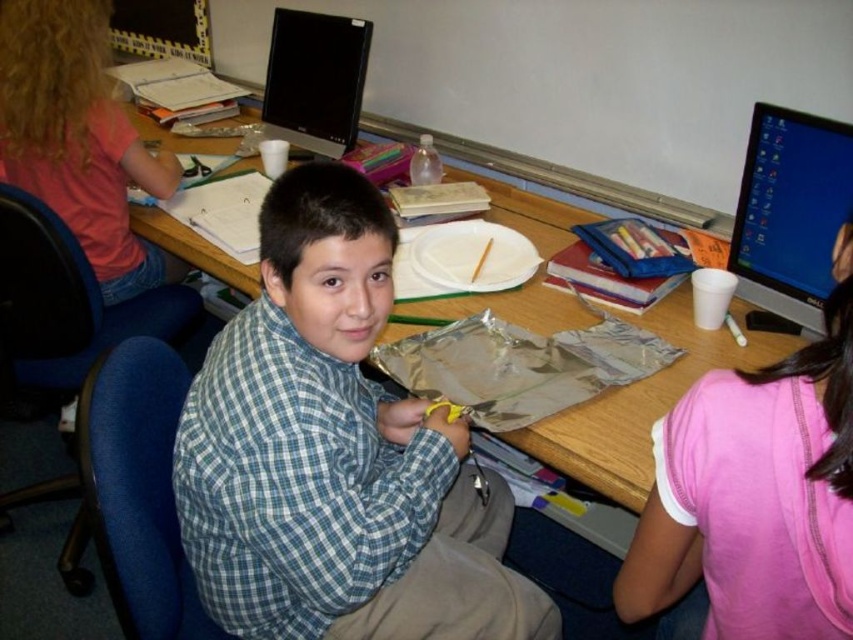
Question: Can you confirm if wooden desk at center is smaller than matte black monitor at upper right?

Choices:
 (A) no
 (B) yes

Answer: (A)

Question: Does blue plaid shirt at center have a smaller size compared to matte black monitor at upper right?

Choices:
 (A) no
 (B) yes

Answer: (A)

Question: Does blue plaid shirt at center have a larger size compared to wooden desk at center?

Choices:
 (A) no
 (B) yes

Answer: (A)

Question: Which of the following is the closest to the observer?

Choices:
 (A) (351, 33)
 (B) (332, 204)

Answer: (B)

Question: Which of the following is the closest to the observer?

Choices:
 (A) blue plaid shirt at center
 (B) wooden desk at center
 (C) matte black monitor at upper center

Answer: (A)

Question: Which point is closer to the camera taking this photo?

Choices:
 (A) (780, 182)
 (B) (792, 637)
 (C) (311, 81)
 (D) (349, 344)

Answer: (B)